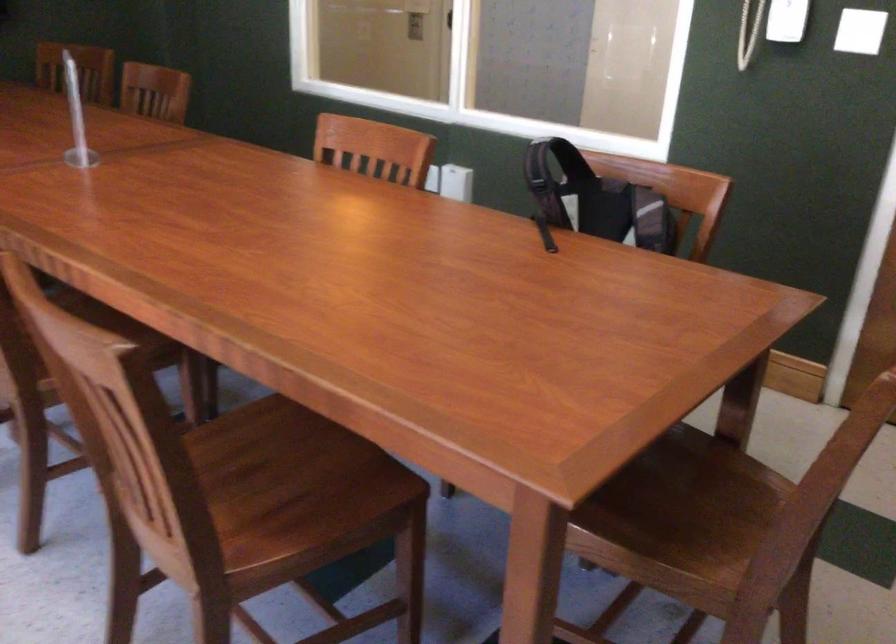
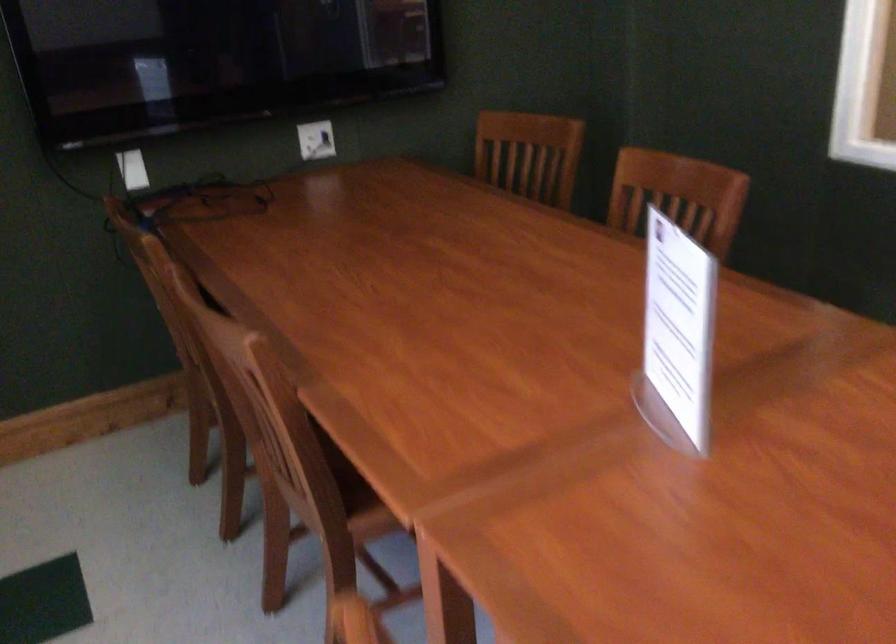
Find the pixel in the second image that matches [74,71] in the first image.

(529, 154)